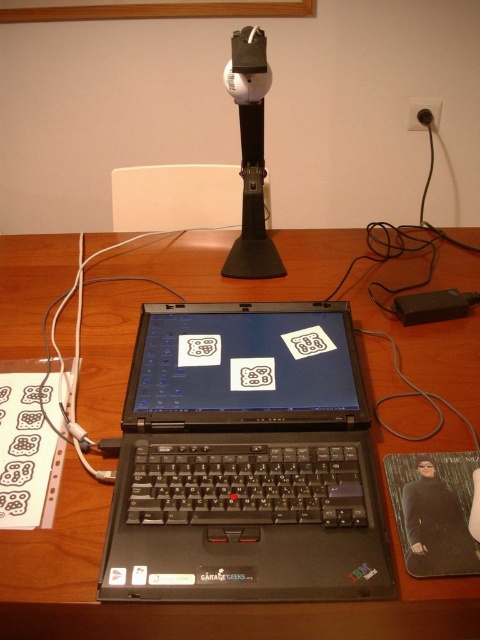
Question: Is wooden table at center below black plastic plug at upper right?

Choices:
 (A) no
 (B) yes

Answer: (B)

Question: Is wooden table at center above black plastic plug at upper right?

Choices:
 (A) yes
 (B) no

Answer: (B)

Question: Estimate the real-world distances between objects in this image. Which object is closer to the white matte microphone at upper center?

Choices:
 (A) black plastic laptop at center
 (B) black plastic plug at upper right
 (C) wooden table at center

Answer: (C)

Question: Which object appears closest to the camera in this image?

Choices:
 (A) white matte microphone at upper center
 (B) black plastic laptop at center
 (C) black plastic plug at upper right

Answer: (B)

Question: Is wooden table at center below black plastic plug at upper right?

Choices:
 (A) no
 (B) yes

Answer: (B)

Question: Based on their relative distances, which object is farther from the black plastic plug at upper right?

Choices:
 (A) wooden table at center
 (B) white matte microphone at upper center
 (C) black plastic laptop at center

Answer: (C)